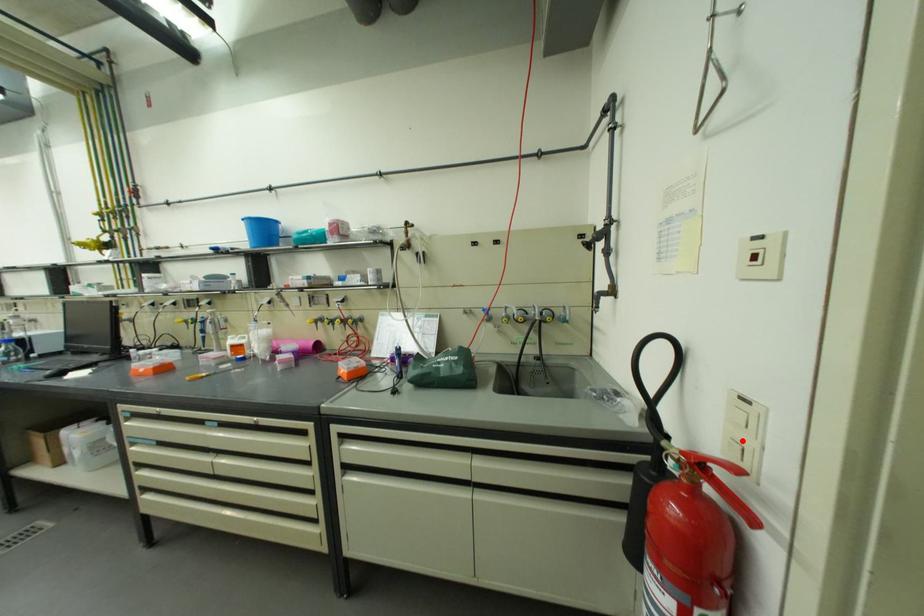
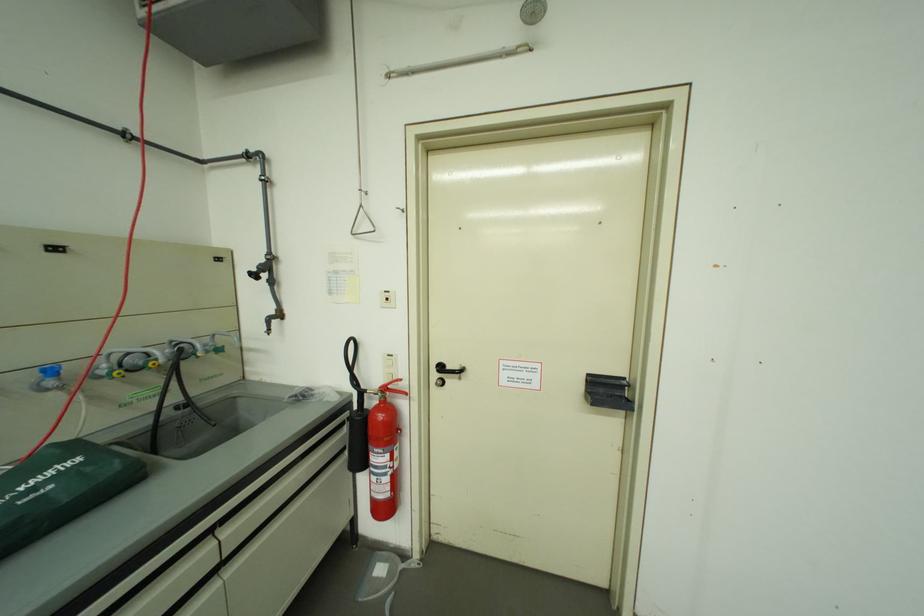
In the second image, find the point that corresponds to the highlighted location in the first image.

(397, 375)